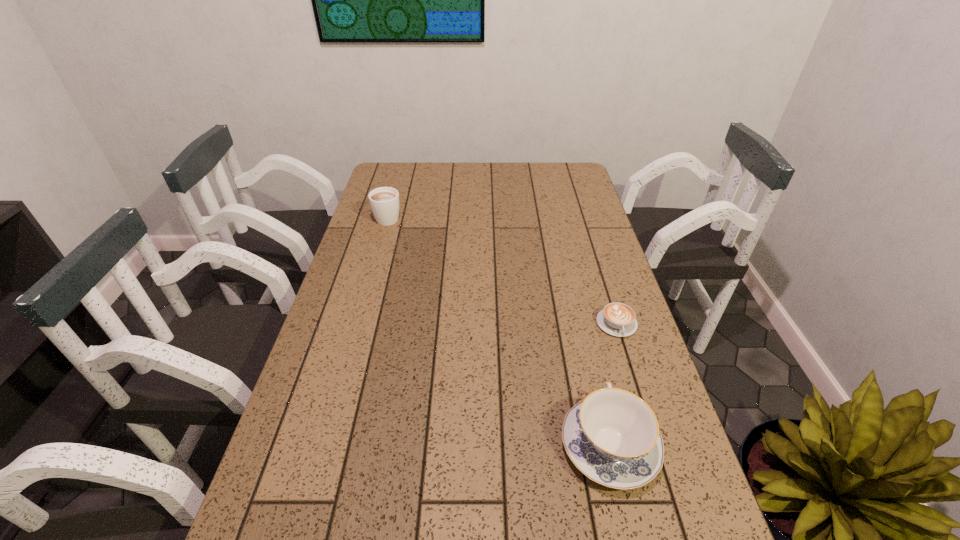
At what (x,y) coordinates should I click in order to perform the action: click on the farthest object. Please return your answer as a coordinate pair (x, y). Looking at the image, I should click on (384, 201).

Where is `the taller cappuccino`? The image size is (960, 540). the taller cappuccino is located at coordinates (384, 201).

Image resolution: width=960 pixels, height=540 pixels. I want to click on chinaware, so click(612, 436).

The width and height of the screenshot is (960, 540). What are the coordinates of `the second farthest object` in the screenshot? It's located at (617, 319).

I want to click on the right cappuccino, so click(617, 319).

You are a GUI agent. You are given a task and a screenshot of the screen. Output one action in this format:
    pyautogui.click(x=<x>, y=<y>)
    Task: Click on the free space located 0.130m with the handle on the side of the taller cappuccino
    
    Given the screenshot: What is the action you would take?
    pyautogui.click(x=396, y=189)

Locate an element on the screen. This screenshot has height=540, width=960. vacant space situated with the handle on the side of the taller cappuccino is located at coordinates (399, 177).

This screenshot has height=540, width=960. What are the coordinates of `blank space located with the handle on the side of the taller cappuccino` in the screenshot? It's located at (396, 189).

Image resolution: width=960 pixels, height=540 pixels. What are the coordinates of `free space located with the handle on the side of the nearest object` in the screenshot? It's located at (573, 292).

The image size is (960, 540). I want to click on free spot located with the handle on the side of the nearest object, so click(x=579, y=315).